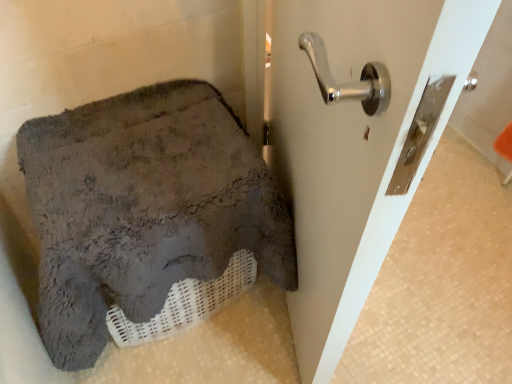
Where is `gray textured towel at center`? gray textured towel at center is located at coordinates (147, 217).

What do you see at coordinates (147, 217) in the screenshot? I see `gray textured towel at center` at bounding box center [147, 217].

I want to click on gray textured towel at center, so click(147, 217).